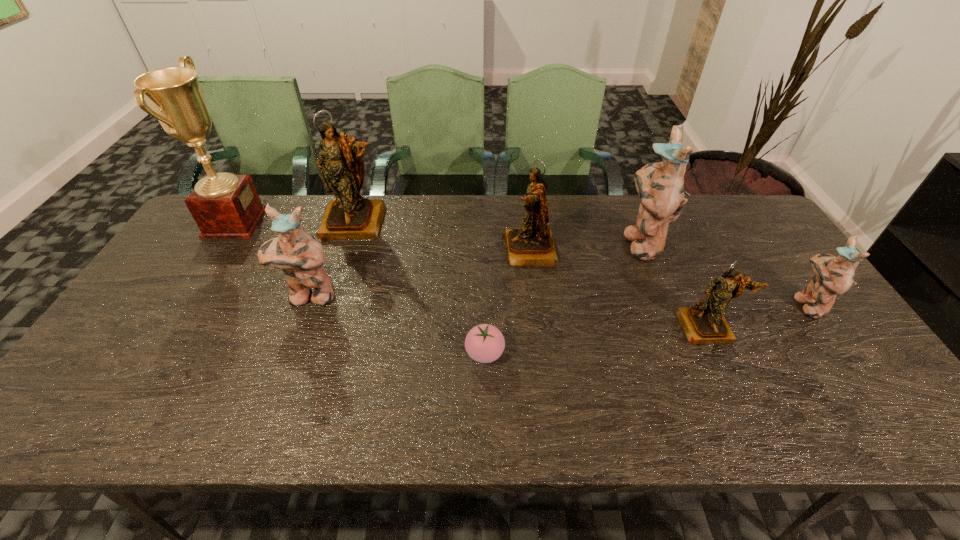
Choose which gold figurine is the nearest neighbor to the leftmost pink figurine. Please provide its 2D coordinates. Your answer should be formatted as a tuple, i.e. [(x, y)], where the tuple contains the x and y coordinates of a point satisfying the conditions above.

[(350, 216)]

The height and width of the screenshot is (540, 960). Find the location of `blank space that satisfies the following two spatial constraints: 1. on the front-facing side of the tomato; 2. on the left side of the leftmost gold figurine`. blank space that satisfies the following two spatial constraints: 1. on the front-facing side of the tomato; 2. on the left side of the leftmost gold figurine is located at coordinates (313, 353).

Locate an element on the screen. This screenshot has width=960, height=540. free space that satisfies the following two spatial constraints: 1. on the front-facing side of the second gold figurine from right to left; 2. on the front-facing side of the second smallest pink figurine is located at coordinates (535, 297).

The width and height of the screenshot is (960, 540). What are the coordinates of `free spot that satisfies the following two spatial constraints: 1. on the plaque of the red tomato; 2. on the left side of the trophy cup` in the screenshot? It's located at (152, 353).

Image resolution: width=960 pixels, height=540 pixels. Identify the location of free space that satisfies the following two spatial constraints: 1. on the front-facing side of the biggest gold figurine; 2. on the plaque of the tallest object. (355, 222).

I want to click on free spot that satisfies the following two spatial constraints: 1. on the front-facing side of the fourth object from right to left; 2. on the front-facing side of the second biggest pink figurine, so click(535, 297).

Locate an element on the screen. blank space that satisfies the following two spatial constraints: 1. on the front-facing side of the rightmost figurine; 2. on the front-facing side of the rightmost gold figurine is located at coordinates click(x=823, y=327).